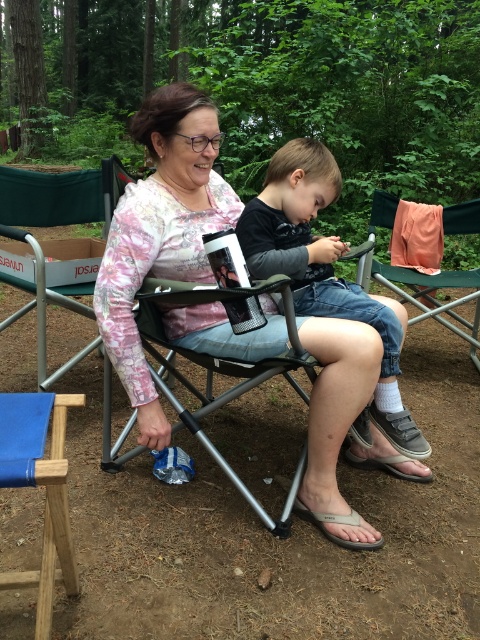
Does pink floral shirt at center have a greater height compared to green fabric chair at center?

Yes, pink floral shirt at center is taller than green fabric chair at center.

What do you see at coordinates (160, 232) in the screenshot?
I see `pink floral shirt at center` at bounding box center [160, 232].

Where is `pink floral shirt at center`? The width and height of the screenshot is (480, 640). pink floral shirt at center is located at coordinates (160, 232).

Does dark gray fabric toddler at center appear over blue fabric folding chair at lower left?

Yes.

Can you confirm if dark gray fabric toddler at center is smaller than blue fabric folding chair at lower left?

Actually, dark gray fabric toddler at center might be larger than blue fabric folding chair at lower left.

The image size is (480, 640). What do you see at coordinates (326, 282) in the screenshot?
I see `dark gray fabric toddler at center` at bounding box center [326, 282].

Locate an element on the screen. This screenshot has height=640, width=480. dark gray fabric toddler at center is located at coordinates point(326,282).

Is metallic silver chair at center behind blue fabric folding chair at lower left?

That is True.

Is metallic silver chair at center to the left of blue fabric folding chair at lower left from the viewer's perspective?

No, metallic silver chair at center is not to the left of blue fabric folding chair at lower left.

The image size is (480, 640). What do you see at coordinates (216, 365) in the screenshot? I see `metallic silver chair at center` at bounding box center [216, 365].

Identify the location of metallic silver chair at center. (216, 365).